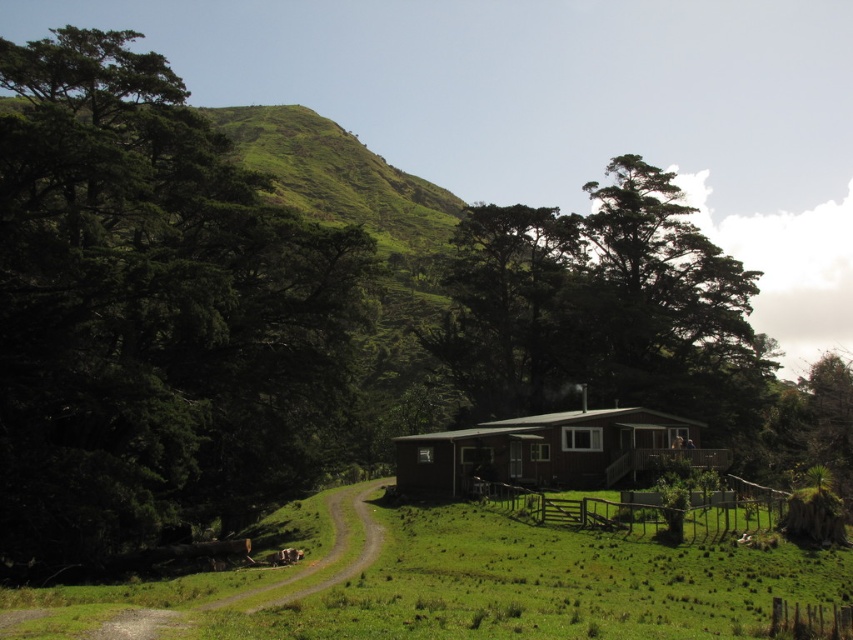
You are planning to set up a picnic blanket in the green grassy field at center. Considering the space available, will there be enough room for both the picnic blanket and the brown wooden hut at center to coexist without overlapping?

The green grassy field at center might be wider than brown wooden hut at center, so there could be enough space for both the picnic blanket and the hut to coexist without overlapping. However, the exact dimensions are uncertain based on the provided information.

You are standing on the deck of the house and looking towards the green grassy field at center and the brown wooden hut at center. Which object is located lower in your field of view?

The green grassy field at center is located lower in your field of view because it is positioned below the brown wooden hut at center.

You are standing at the house and want to walk to a specific location. There are two points marked on the map as point 1 at coordinates (267, 573) and point 2 at coordinates (531, 346). Which point is closer to you?

Point 1 at coordinates (267, 573) is closer to you because it is in front of point 2 at coordinates (531, 346).